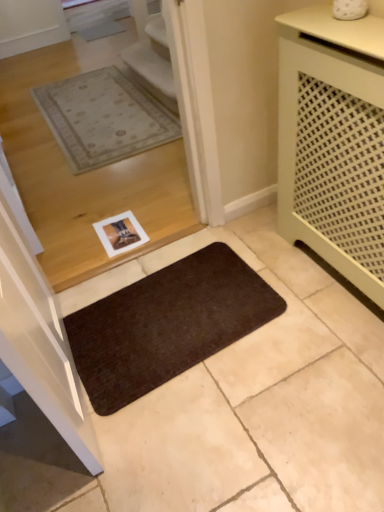
Locate an element on the screen. This screenshot has height=512, width=384. free space that is to the left of matte green cabinet at right is located at coordinates (238, 288).